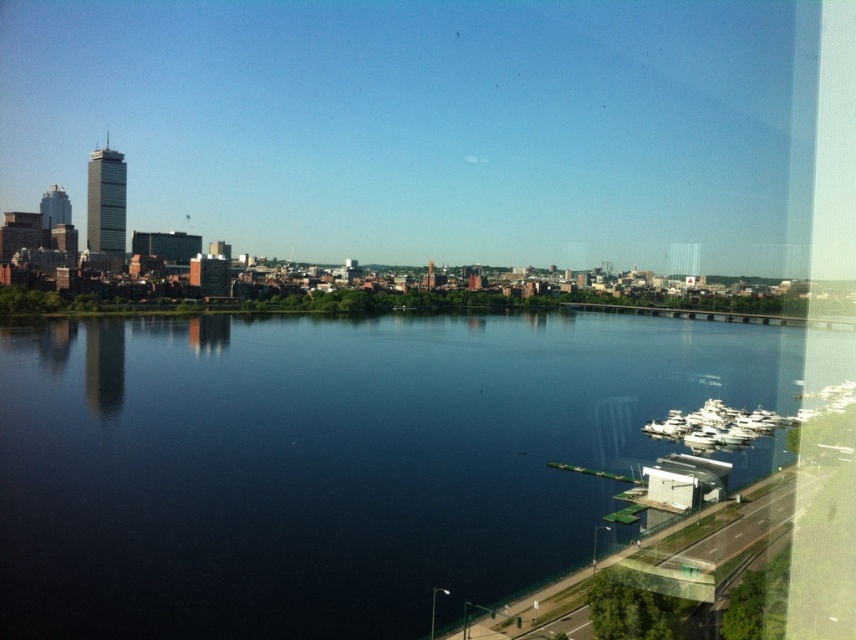
Can you confirm if dark blue water at center is bigger than white glossy boats at lower right?

Answer: Correct, dark blue water at center is larger in size than white glossy boats at lower right.

Is dark blue water at center to the right of white glossy boats at lower right from the viewer's perspective?

Incorrect, dark blue water at center is not on the right side of white glossy boats at lower right.

Locate an element on the screen. This screenshot has width=856, height=640. dark blue water at center is located at coordinates (336, 460).